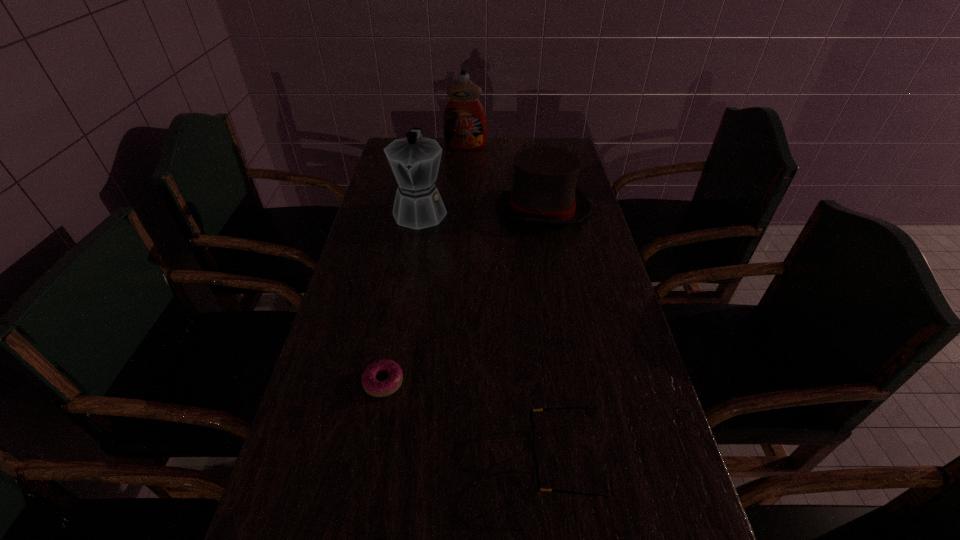
You are a GUI agent. You are given a task and a screenshot of the screen. Output one action in this format:
    pyautogui.click(x=<x>, y=<y>)
    Task: Click on the object that stands as the closest to the third tallest object
    This screenshot has width=960, height=540.
    Given the screenshot: What is the action you would take?
    pyautogui.click(x=415, y=160)

At what (x,y) coordinates should I click in order to perform the action: click on free location that satisfies the following two spatial constraints: 1. on the back side of the dress hat; 2. on the right side of the doughnut. Please return your answer as a coordinate pair (x, y). Looking at the image, I should click on (416, 209).